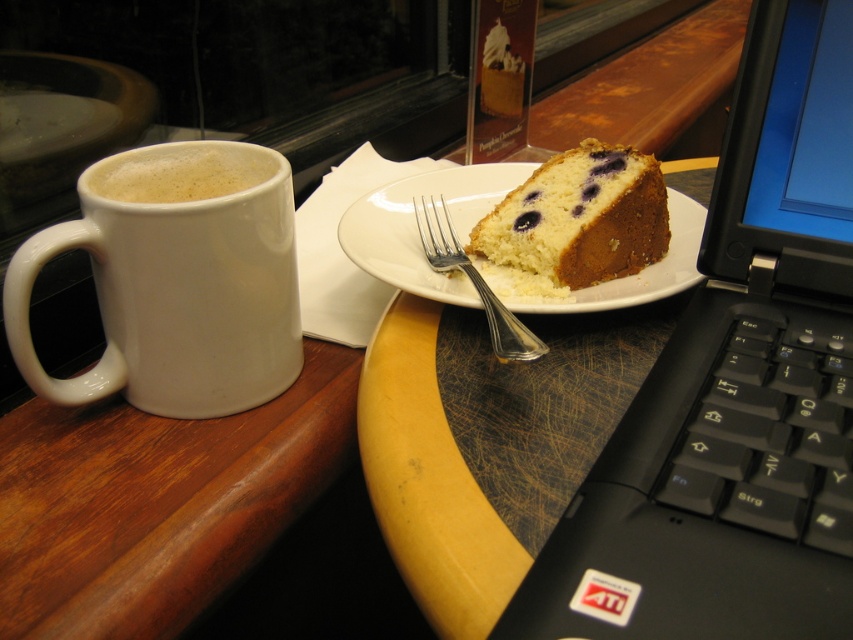
Who is more distant from viewer, (770, 160) or (236, 326)?

Positioned behind is point (236, 326).

Is black plastic laptop at right bigger than white glossy mug at left?

Yes.

Is point (753, 308) farther from viewer compared to point (167, 272)?

No, (753, 308) is closer to viewer.

Identify the location of black plastic laptop at right. (735, 388).

Is white glossy mug at left smaller than white matte cup at left?

Actually, white glossy mug at left might be larger than white matte cup at left.

Who is positioned more to the right, white glossy mug at left or white matte cup at left?

From the viewer's perspective, white glossy mug at left appears more on the right side.

Is point (137, 291) farther from camera compared to point (137, 154)?

No.

You are a GUI agent. You are given a task and a screenshot of the screen. Output one action in this format:
    pyautogui.click(x=<x>, y=<y>)
    Task: Click on the white glossy mug at left
    The width and height of the screenshot is (853, 640).
    Given the screenshot: What is the action you would take?
    pyautogui.click(x=177, y=288)

Is white ceramic plate at center thinner than white matte cup at left?

No, white ceramic plate at center is not thinner than white matte cup at left.

Where is `white ceramic plate at center`? white ceramic plate at center is located at coordinates (415, 225).